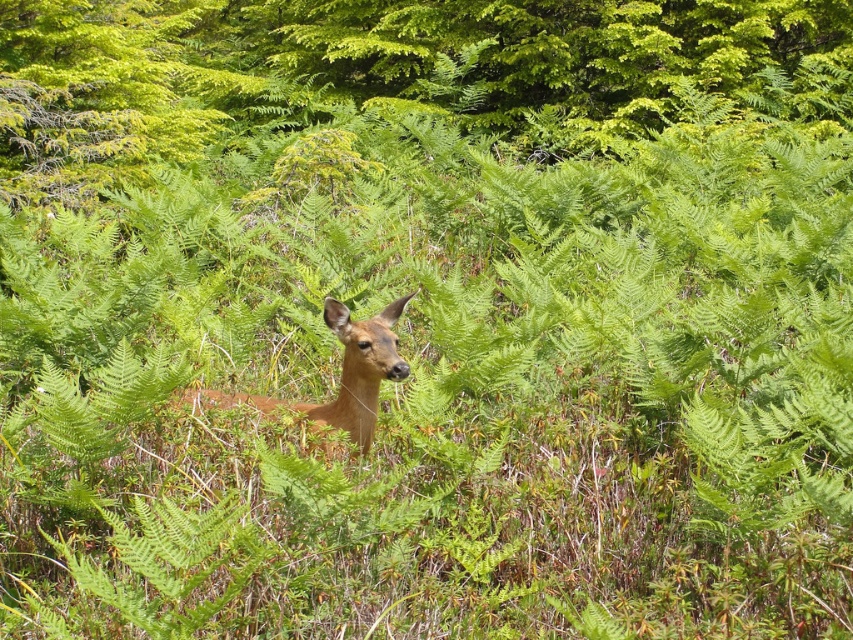
You are standing in the middle of the ferns and want to find the green leafy tree at center. Which direction should you look to locate it?

The green leafy tree at center is located at coordinates 0.111 on the x axis and 0.443 on the y axis, so you should look towards the lower left direction to find it.